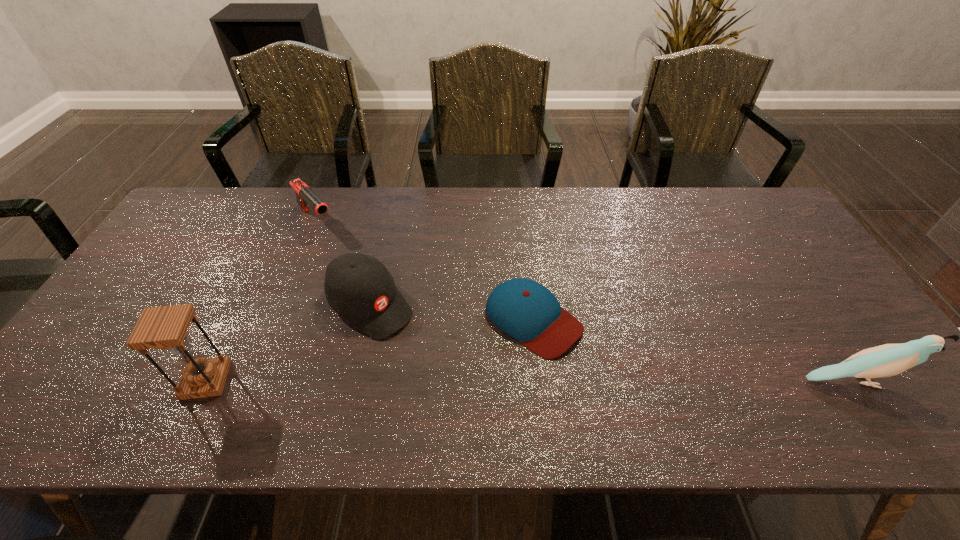
Where is `vacant region located with a logo on the front of the left baseball cap`? The height and width of the screenshot is (540, 960). vacant region located with a logo on the front of the left baseball cap is located at coordinates (467, 387).

At what (x,y) coordinates should I click in order to perform the action: click on free space located with a logo on the front of the left baseball cap. Please return your answer as a coordinate pair (x, y). The height and width of the screenshot is (540, 960). Looking at the image, I should click on (464, 384).

The width and height of the screenshot is (960, 540). I want to click on vacant position located 0.140m at the aiming end of the farthest object, so click(348, 258).

This screenshot has width=960, height=540. In order to click on vacant space situated at the aiming end of the farthest object in this screenshot , I will do `click(350, 260)`.

You are a GUI agent. You are given a task and a screenshot of the screen. Output one action in this format:
    pyautogui.click(x=<x>, y=<y>)
    Task: Click on the free region located 0.280m at the aiming end of the farthest object
    Image resolution: width=960 pixels, height=540 pixels.
    Given the screenshot: What is the action you would take?
    pyautogui.click(x=373, y=284)

Where is `blank space located with the bill of the second object from right to left facing forward`? The image size is (960, 540). blank space located with the bill of the second object from right to left facing forward is located at coordinates (600, 367).

What are the coordinates of `free space located 0.130m with the bill of the second object from right to left facing forward` in the screenshot? It's located at (618, 381).

Image resolution: width=960 pixels, height=540 pixels. Find the location of `vacant region located 0.130m with the bill of the second object from right to left facing forward`. vacant region located 0.130m with the bill of the second object from right to left facing forward is located at coordinates (618, 381).

Identify the location of object that is at the far edge. The width and height of the screenshot is (960, 540). (305, 196).

Locate an element on the screen. hourglass that is at the near edge is located at coordinates (165, 327).